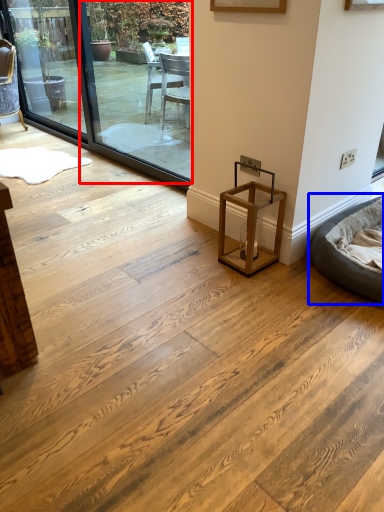
Question: Which of the following is the farthest to the observer, window screen (highlighted by a red box) or bean bag chair (highlighted by a blue box)?

Choices:
 (A) window screen
 (B) bean bag chair

Answer: (A)